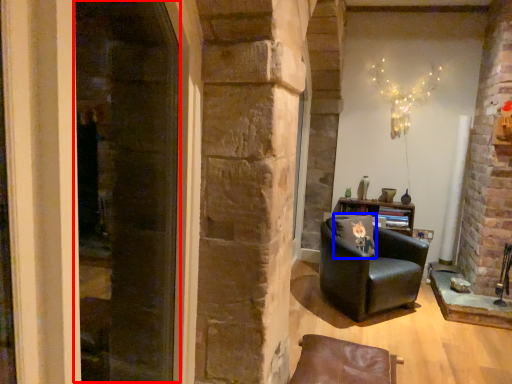
Question: Which point is closer to the camera, screen door (highlighted by a red box) or pillow (highlighted by a blue box)?

Choices:
 (A) screen door
 (B) pillow

Answer: (A)